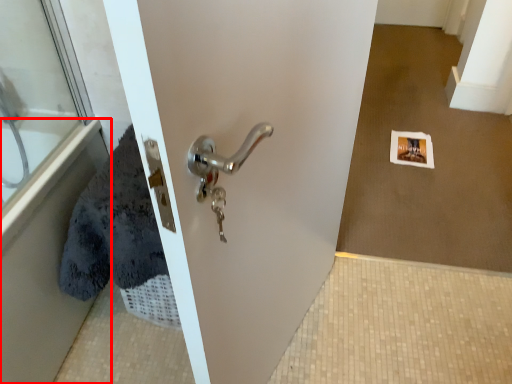
Question: From the image's perspective, where is bath (annotated by the red box) located in relation to glass door in the image?

Choices:
 (A) below
 (B) above

Answer: (A)